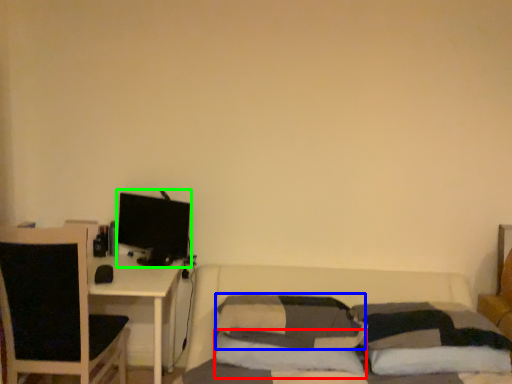
Question: Which object is positioned farthest from pillow (highlighted by a red box)? Select from pillow (highlighted by a blue box) and computer monitor (highlighted by a green box).

Choices:
 (A) pillow
 (B) computer monitor

Answer: (B)